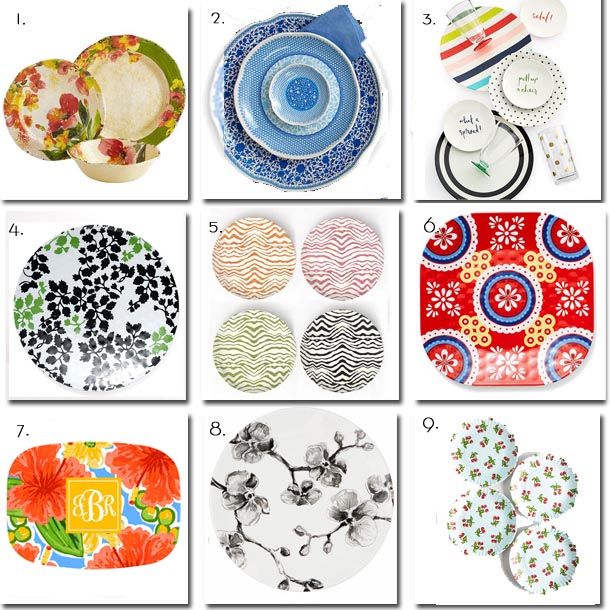
Where is `brightly colored serving tray`? This screenshot has width=610, height=610. brightly colored serving tray is located at coordinates (63, 554).